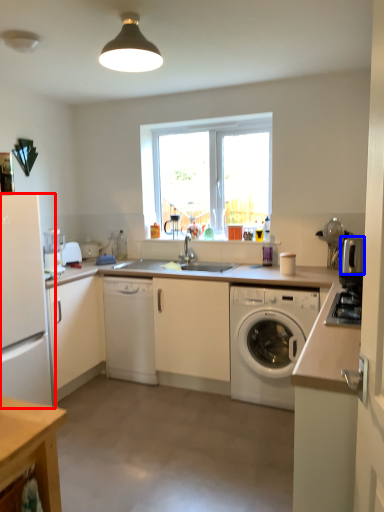
Question: Which object is further to the camera taking this photo, refrigerator (highlighted by a red box) or appliance (highlighted by a blue box)?

Choices:
 (A) refrigerator
 (B) appliance

Answer: (B)